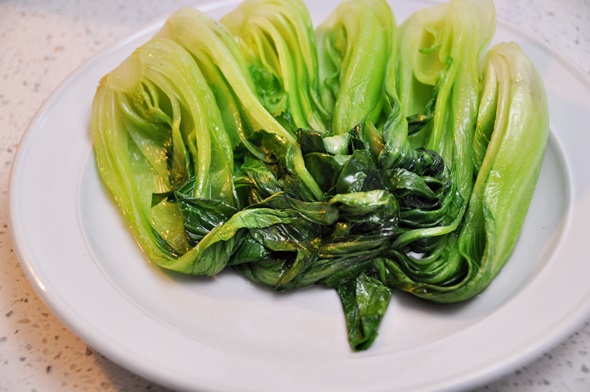
Locate an element on the screen. plate is located at coordinates (563, 279).